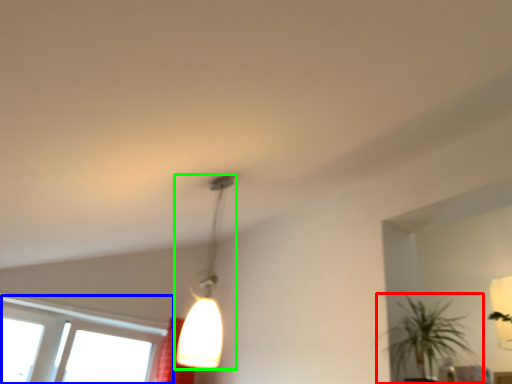
Question: Which object is positioned closest to houseplant (highlighted by a red box)? Select from window (highlighted by a blue box) and lamp (highlighted by a green box).

Choices:
 (A) window
 (B) lamp

Answer: (B)